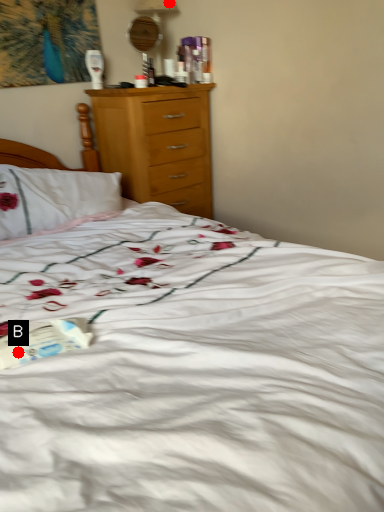
Question: Two points are circled on the image, labeled by A and B beside each circle. Among these points, which one is nearest to the camera?

Choices:
 (A) A is closer
 (B) B is closer

Answer: (B)